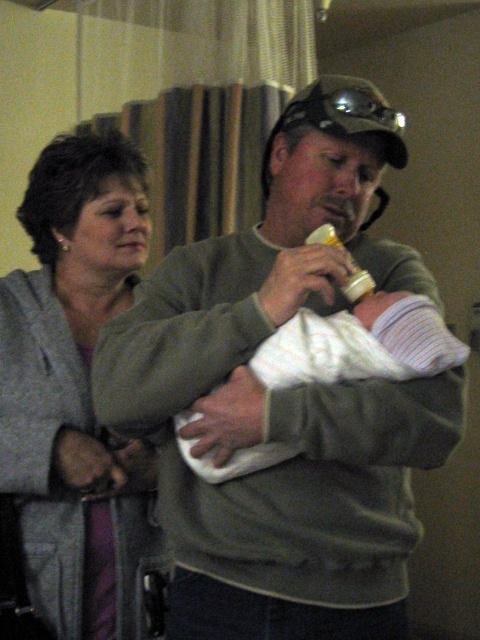
Is point (387, 492) positioned after point (112, 538)?

No.

Can you confirm if green matte sweater at center is wider than gray fleece jacket at upper left?

Yes, green matte sweater at center is wider than gray fleece jacket at upper left.

Image resolution: width=480 pixels, height=640 pixels. I want to click on green matte sweater at center, so click(284, 397).

Is green matte sweater at center to the right of white soft cloth at center from the viewer's perspective?

In fact, green matte sweater at center is to the left of white soft cloth at center.

Does green matte sweater at center have a lesser width compared to white soft cloth at center?

No, green matte sweater at center is not thinner than white soft cloth at center.

Is point (422, 442) positioned in front of point (197, 413)?

That is True.

Where is `green matte sweater at center`? The height and width of the screenshot is (640, 480). green matte sweater at center is located at coordinates (284, 397).

How far apart are gray fleece jacket at upper left and white soft cloth at center?

They are 18.31 inches apart.

Does gray fleece jacket at upper left have a lesser width compared to white soft cloth at center?

Indeed, gray fleece jacket at upper left has a lesser width compared to white soft cloth at center.

Locate an element on the screen. This screenshot has width=480, height=640. gray fleece jacket at upper left is located at coordinates (78, 397).